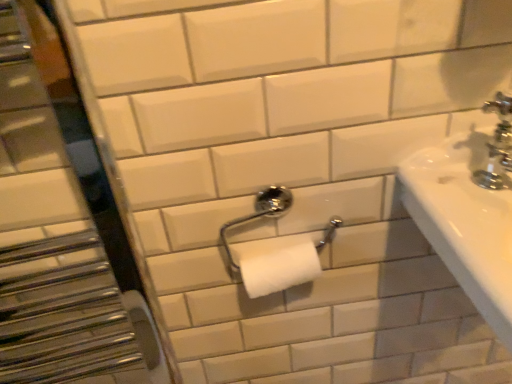
Question: Should I look upward or downward to see chrome metallic toilet paper holder at center?

Choices:
 (A) up
 (B) down

Answer: (B)

Question: Is chrome metallic faucet at upper right turned away from chrome metallic toilet paper holder at center?

Choices:
 (A) no
 (B) yes

Answer: (A)

Question: Is chrome metallic faucet at upper right surrounding chrome metallic toilet paper holder at center?

Choices:
 (A) no
 (B) yes

Answer: (A)

Question: Can you confirm if chrome metallic faucet at upper right is positioned to the right of chrome metallic toilet paper holder at center?

Choices:
 (A) no
 (B) yes

Answer: (B)

Question: Is chrome metallic faucet at upper right positioned in front of chrome metallic toilet paper holder at center?

Choices:
 (A) yes
 (B) no

Answer: (A)

Question: Is chrome metallic faucet at upper right in contact with chrome metallic toilet paper holder at center?

Choices:
 (A) no
 (B) yes

Answer: (A)

Question: Does chrome metallic faucet at upper right come behind chrome metallic toilet paper holder at center?

Choices:
 (A) yes
 (B) no

Answer: (B)

Question: Can you confirm if brushed metal mirror at left is smaller than chrome metallic faucet at upper right?

Choices:
 (A) yes
 (B) no

Answer: (B)

Question: Does brushed metal mirror at left have a larger size compared to chrome metallic faucet at upper right?

Choices:
 (A) no
 (B) yes

Answer: (B)

Question: Is brushed metal mirror at left behind chrome metallic faucet at upper right?

Choices:
 (A) yes
 (B) no

Answer: (B)

Question: Is brushed metal mirror at left not close to chrome metallic faucet at upper right?

Choices:
 (A) no
 (B) yes

Answer: (A)

Question: Can you confirm if brushed metal mirror at left is taller than chrome metallic faucet at upper right?

Choices:
 (A) no
 (B) yes

Answer: (B)

Question: Does brushed metal mirror at left have a lesser width compared to chrome metallic faucet at upper right?

Choices:
 (A) yes
 (B) no

Answer: (B)

Question: Is brushed metal mirror at left to the left of chrome metallic toilet paper holder at center from the viewer's perspective?

Choices:
 (A) yes
 (B) no

Answer: (A)